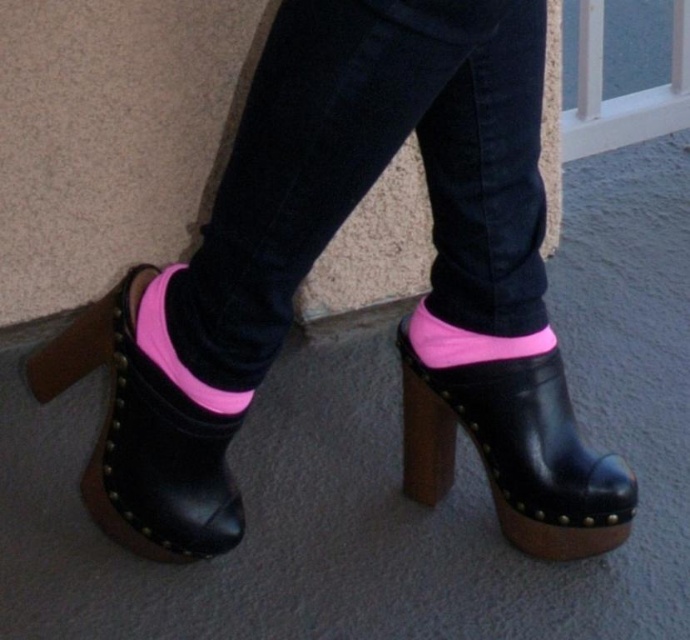
You are standing in front of the image and want to know how far the point at coordinates point (518, 148) is from you. Can you determine the distance?

The point at coordinates point (518, 148) is 3.80 feet away from the camera.